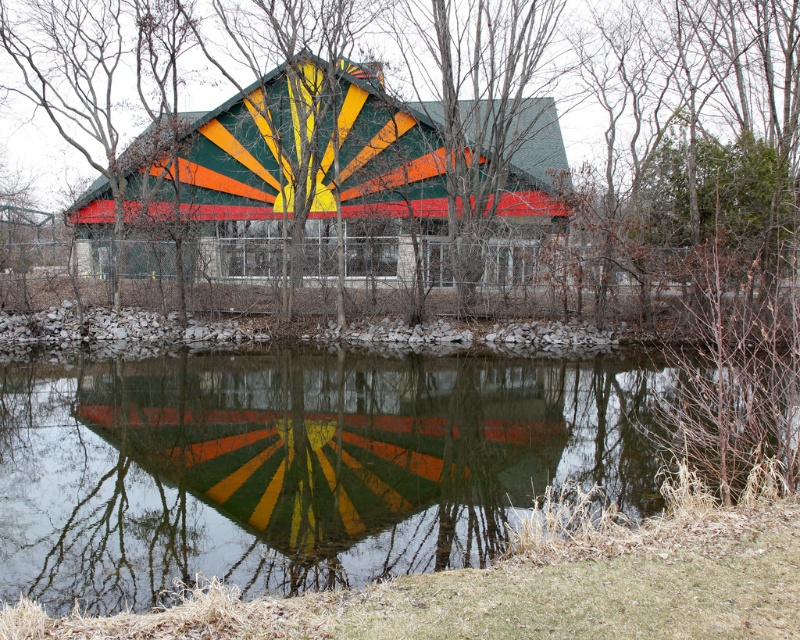
Question: Can you confirm if green matte tree at center is positioned to the right of transparent water at center?

Choices:
 (A) yes
 (B) no

Answer: (A)

Question: Among these points, which one is nearest to the camera?

Choices:
 (A) pyautogui.click(x=148, y=522)
 (B) pyautogui.click(x=132, y=170)

Answer: (A)

Question: Can you confirm if multicolored painted roof at center is positioned to the right of painted wooden barn at center?

Choices:
 (A) no
 (B) yes

Answer: (B)

Question: Can you confirm if transparent water at center is positioned below multicolored painted roof at center?

Choices:
 (A) yes
 (B) no

Answer: (B)

Question: Which point is closer to the camera?

Choices:
 (A) green matte tree at center
 (B) multicolored painted roof at center

Answer: (B)

Question: Which object appears closest to the camera in this image?

Choices:
 (A) transparent water at center
 (B) multicolored painted roof at center
 (C) painted wooden barn at center

Answer: (A)